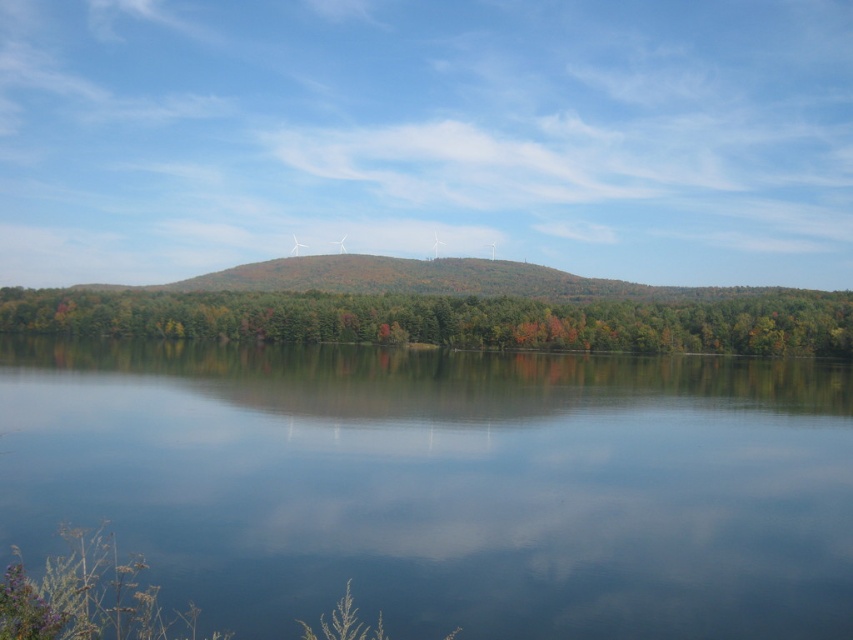
Question: Is transparent water at center smaller than green matte tree at center?

Choices:
 (A) yes
 (B) no

Answer: (A)

Question: Which of the following is the farthest from the observer?

Choices:
 (A) (6, 324)
 (B) (808, 600)

Answer: (A)

Question: Is transparent water at center above green matte tree at center?

Choices:
 (A) no
 (B) yes

Answer: (A)

Question: Which object appears closest to the camera in this image?

Choices:
 (A) transparent water at center
 (B) green matte tree at center

Answer: (A)

Question: Does transparent water at center have a lesser width compared to green matte tree at center?

Choices:
 (A) no
 (B) yes

Answer: (B)